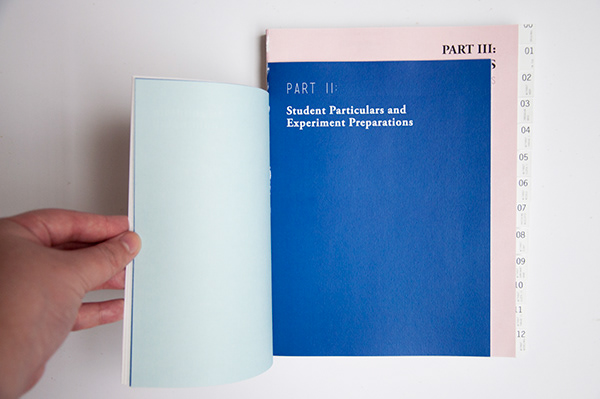
Identify the location of book. [x=286, y=143].